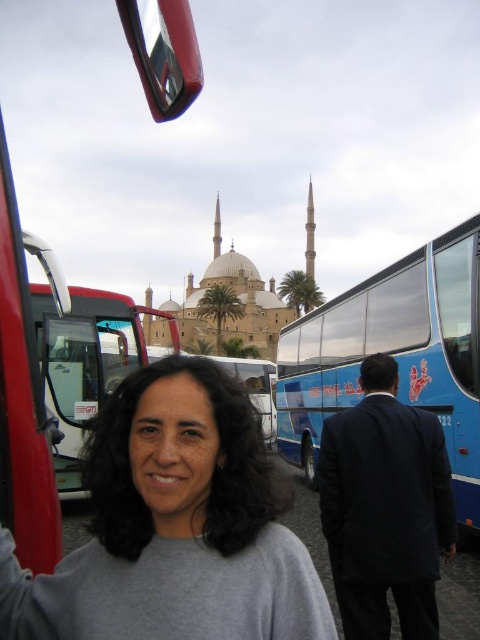
Question: Is gray matte sweater at center further to camera compared to metallic silver bus at left?

Choices:
 (A) no
 (B) yes

Answer: (A)

Question: Does blue glossy bus at right appear under metallic silver bus at left?

Choices:
 (A) yes
 (B) no

Answer: (A)

Question: Which object is farther from the camera taking this photo?

Choices:
 (A) metallic silver bus at left
 (B) gray matte sweater at center
 (C) blue glossy bus at right

Answer: (C)

Question: Which object is the farthest from the blue glossy bus at right?

Choices:
 (A) gray matte sweater at center
 (B) metallic silver bus at left

Answer: (A)

Question: Which is nearer to the metallic silver bus at left?

Choices:
 (A) blue glossy bus at right
 (B) gray matte sweater at center

Answer: (B)

Question: Does gray matte sweater at center appear on the right side of metallic silver bus at left?

Choices:
 (A) yes
 (B) no

Answer: (A)